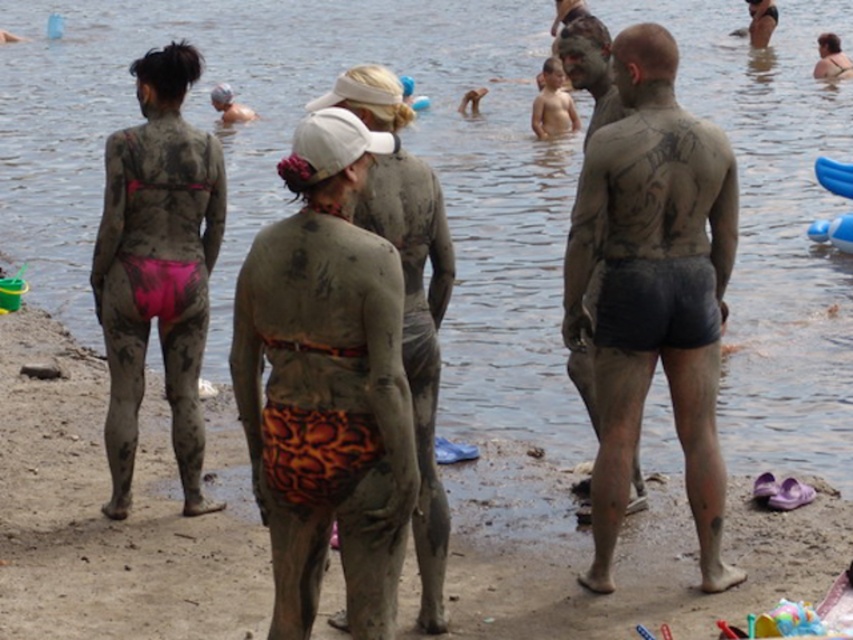
Question: Can you confirm if orange-patterned fabric shorts at center is positioned to the left of orange textured shorts at center?

Choices:
 (A) yes
 (B) no

Answer: (A)

Question: Considering the real-world distances, which object is closest to the orange-patterned fabric shorts at center?

Choices:
 (A) muddy pink bikini bottom at back left
 (B) muddy skin man at center
 (C) muddy skin shorts at center

Answer: (C)

Question: Where is muddy skin shorts at center located in relation to muddy pink bikini bottom at back left in the image?

Choices:
 (A) above
 (B) below

Answer: (B)

Question: Which object is positioned farthest from the muddy skin shorts at center?

Choices:
 (A) muddy skin man at center
 (B) orange-patterned fabric shorts at center
 (C) muddy pink bikini bottom at back left
 (D) orange textured shorts at center

Answer: (C)

Question: Does muddy pink bikini bottom at back left have a lesser width compared to muddy skin man at center?

Choices:
 (A) yes
 (B) no

Answer: (B)

Question: Which is nearer to the muddy skin shorts at center?

Choices:
 (A) orange textured shorts at center
 (B) orange-patterned fabric shorts at center

Answer: (A)